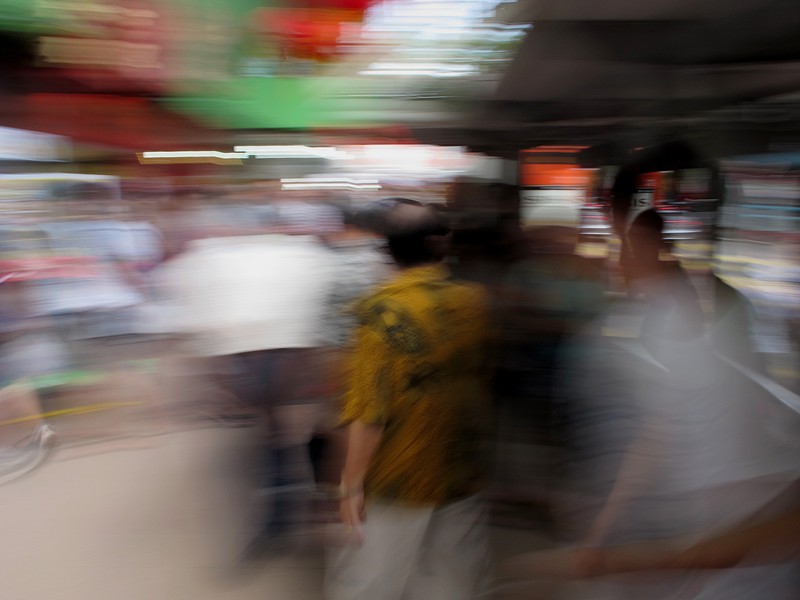
The image size is (800, 600). Identify the location of ceiling light. (416, 167).